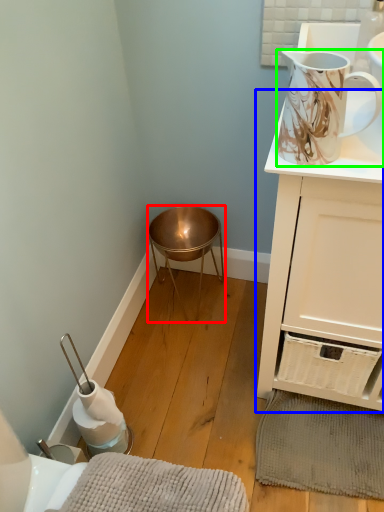
Question: Considering the real-world distances, which object is closest to stool (highlighted by a red box)? cabinetry (highlighted by a blue box) or jug (highlighted by a green box).

Choices:
 (A) cabinetry
 (B) jug

Answer: (A)